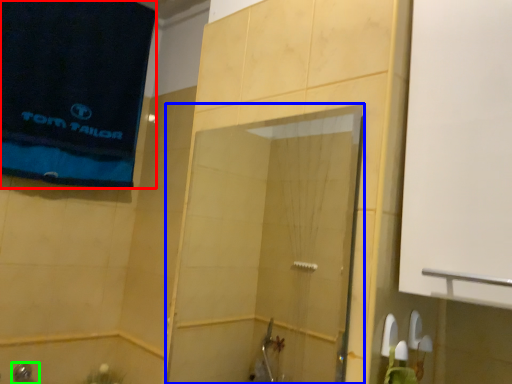
Question: Which object is the farthest from beach towel (highlighted by a red box)? Choose among these: screen door (highlighted by a blue box) or shower (highlighted by a green box).

Choices:
 (A) screen door
 (B) shower

Answer: (B)